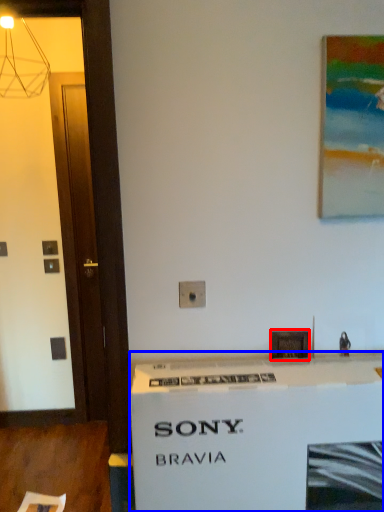
Question: Which of the following is the farthest to the observer, picture frame (highlighted by a red box) or counter (highlighted by a blue box)?

Choices:
 (A) picture frame
 (B) counter

Answer: (A)